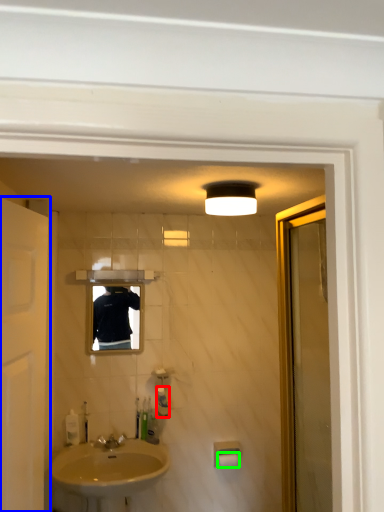
Question: Estimate the real-world distances between objects in this image. Which object is closer to toiletry (highlighted by a red box), door (highlighted by a blue box) or toilet paper (highlighted by a green box)?

Choices:
 (A) door
 (B) toilet paper

Answer: (B)